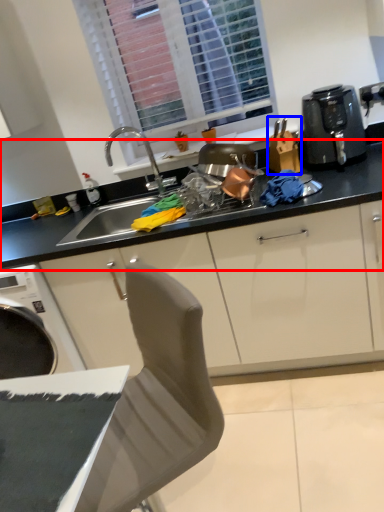
Question: Among these objects, which one is farthest to the camera, countertop (highlighted by a red box) or appliance (highlighted by a blue box)?

Choices:
 (A) countertop
 (B) appliance

Answer: (A)